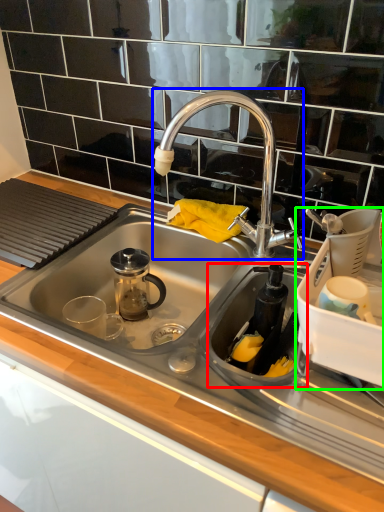
Question: Based on their relative distances, which object is nearer to appliance (highlighted by a red box)? Choose from tap (highlighted by a blue box) and appliance (highlighted by a green box).

Choices:
 (A) tap
 (B) appliance

Answer: (B)